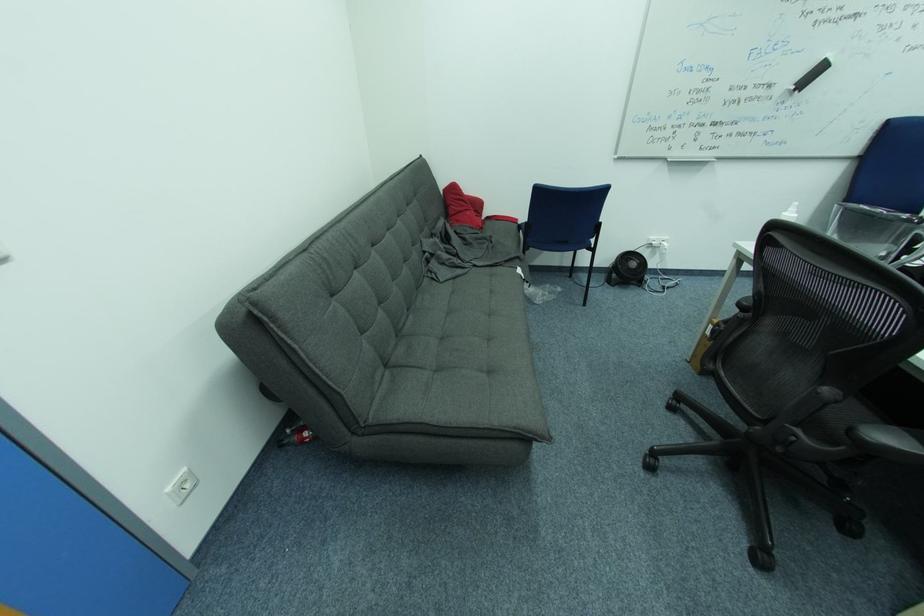
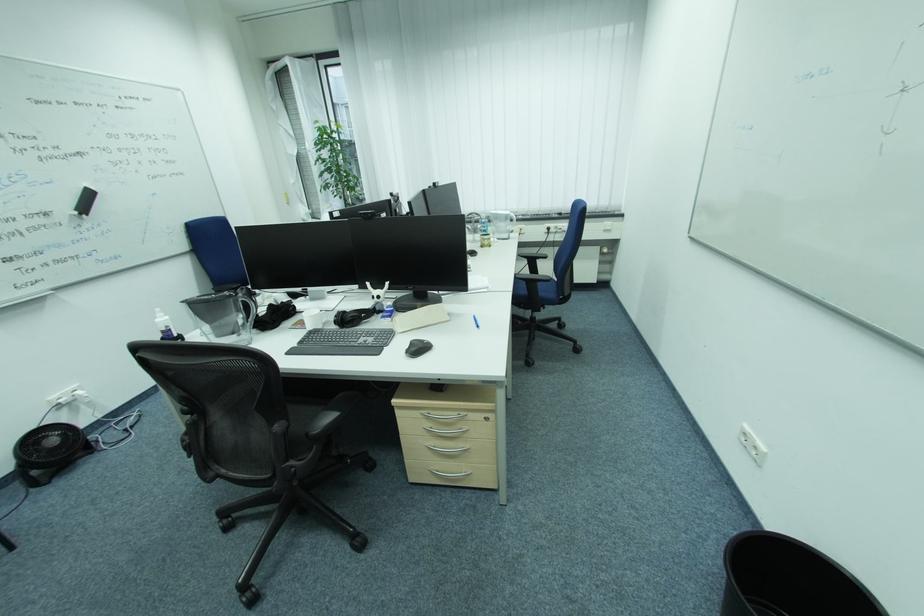
Locate, in the second image, the point that corresponds to (x=844, y=403) in the first image.

(294, 429)